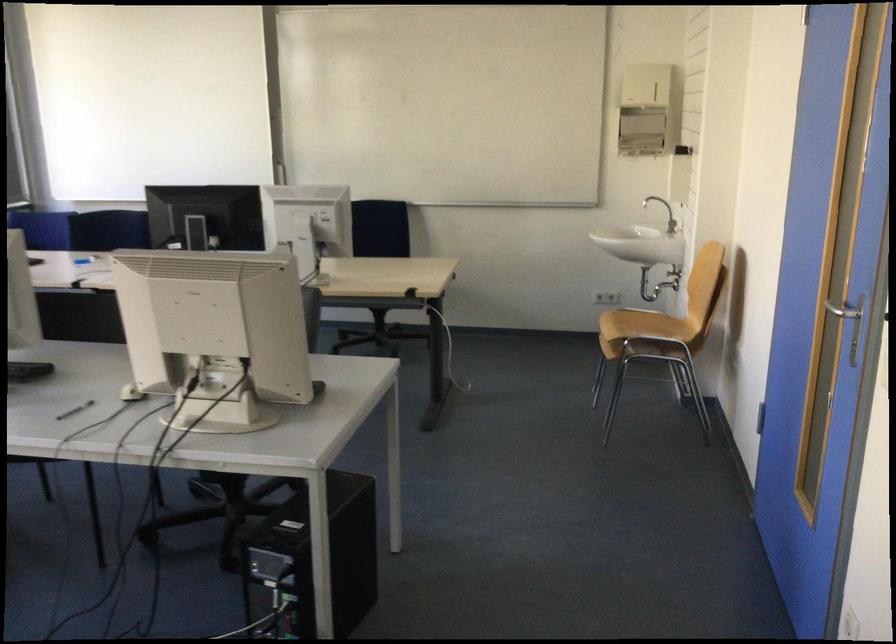
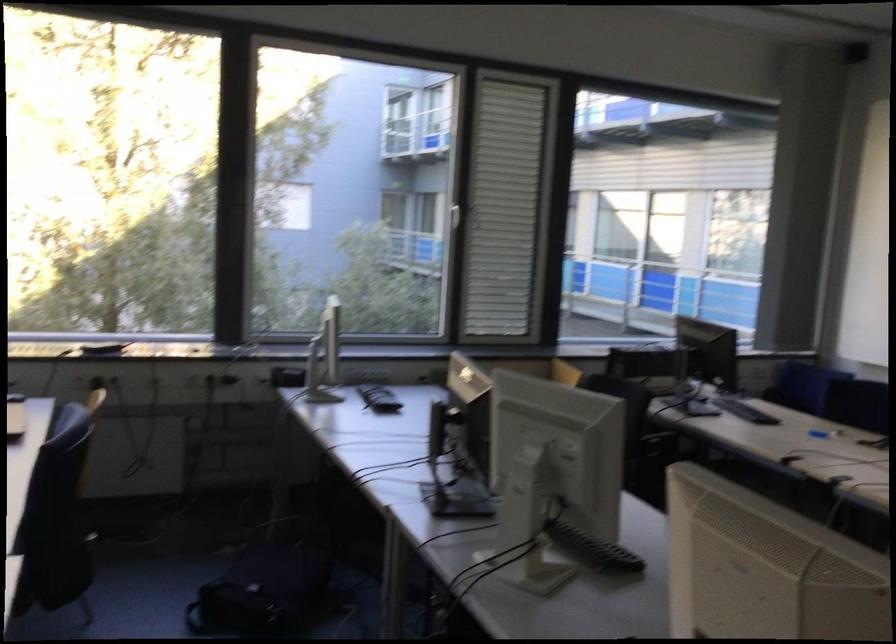
Question: The camera is either moving clockwise (left) or counter-clockwise (right) around the object. The first image is from the beginning of the video and the second image is from the end. Is the camera moving left or right when shooting the video?

Choices:
 (A) Left
 (B) Right

Answer: (B)